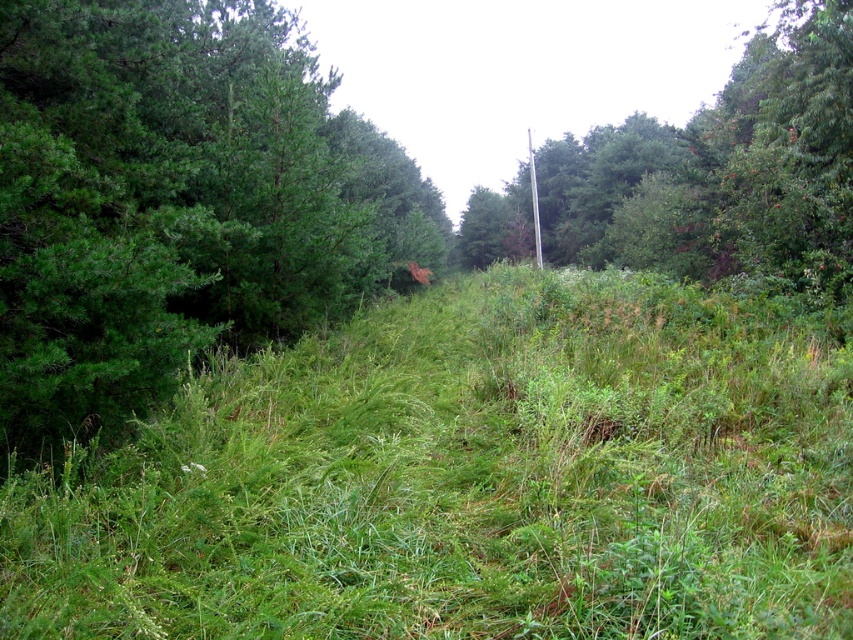
Between green grassy at center and green matte tree at upper center, which one appears on the left side from the viewer's perspective?

green grassy at center

Between green grassy at center and green matte tree at upper center, which one has less height?

Standing shorter between the two is green grassy at center.

Is point (521, 460) positioned behind point (842, 266)?

That is False.

Locate an element on the screen. green grassy at center is located at coordinates (469, 476).